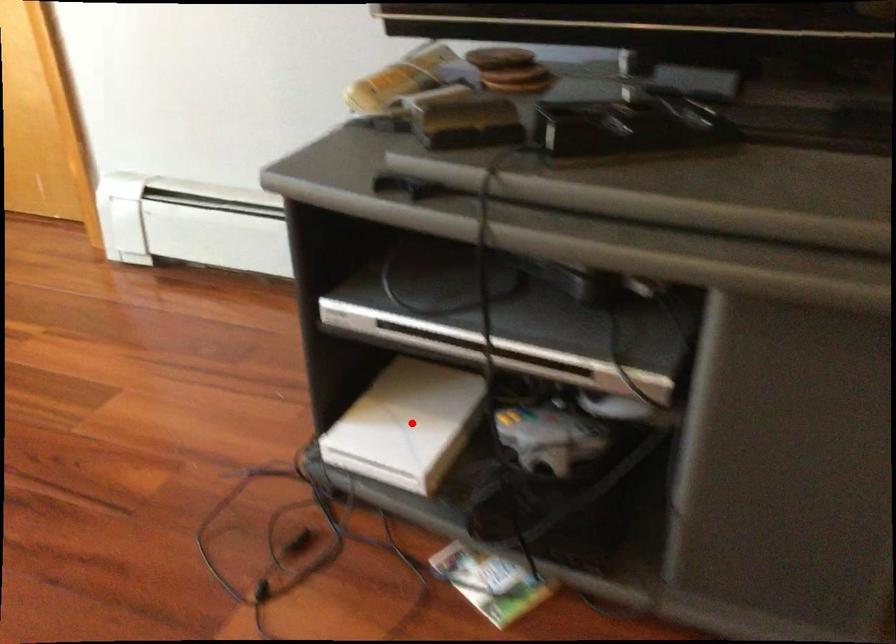
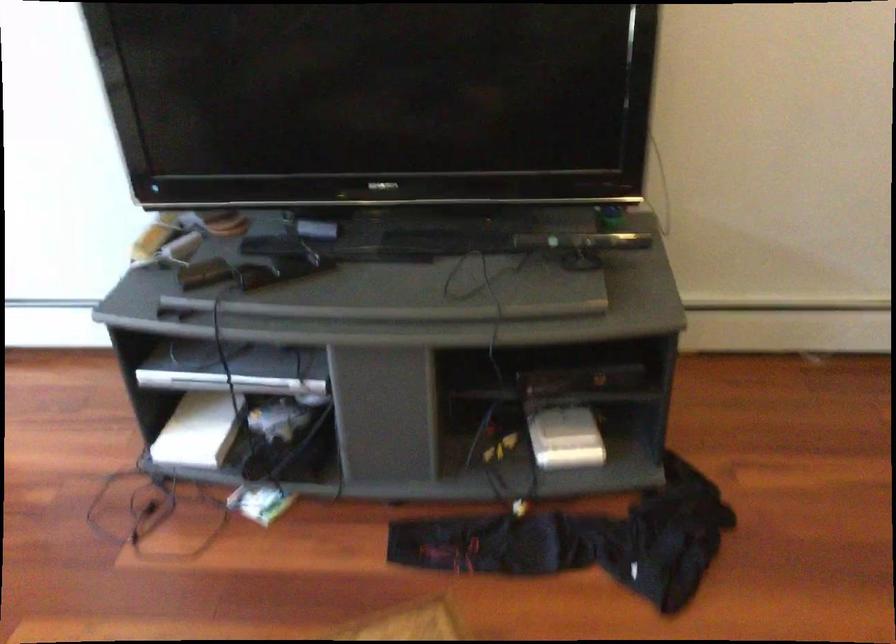
Locate, in the second image, the point that corresponds to the highlighted location in the first image.

(199, 430)